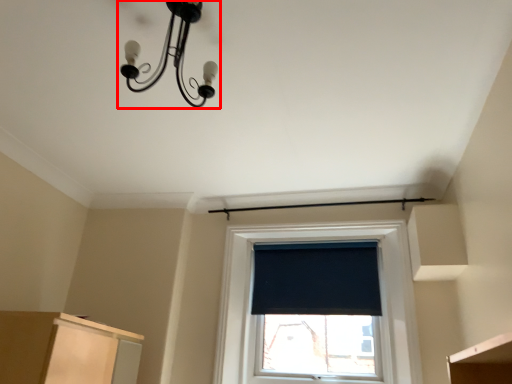
Question: From the image's perspective, what is the correct spatial positioning of lamp (annotated by the red box) in reference to window screen?

Choices:
 (A) above
 (B) below

Answer: (A)